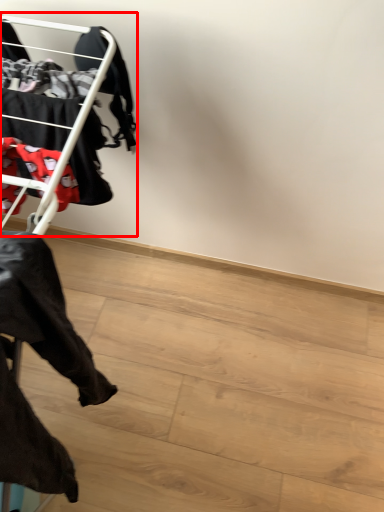
Question: From the image's perspective, considering the relative positions of bunk bed (annotated by the red box) and furniture in the image provided, where is bunk bed (annotated by the red box) located with respect to the staircase?

Choices:
 (A) below
 (B) above

Answer: (B)